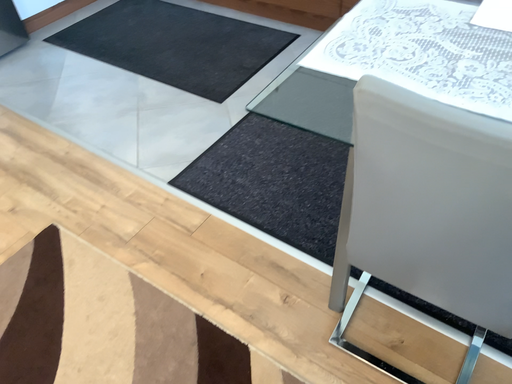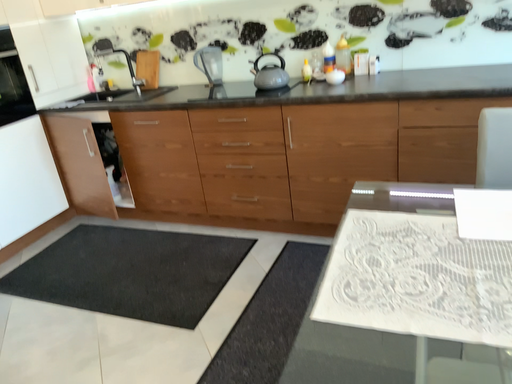
Question: Which way did the camera rotate in the video?

Choices:
 (A) rotated upward
 (B) rotated downward

Answer: (A)